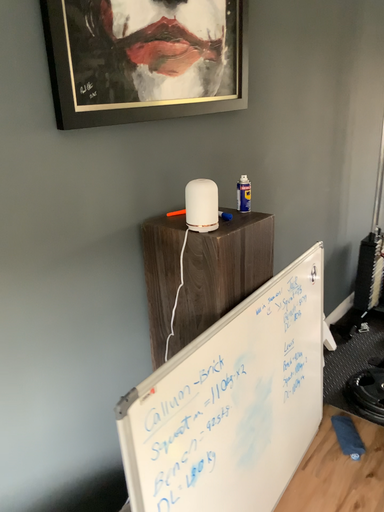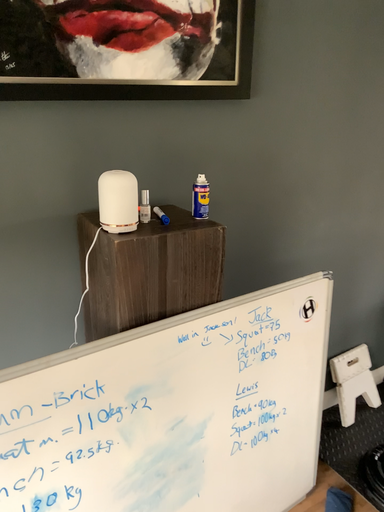
Question: How did the camera likely rotate when shooting the video?

Choices:
 (A) rotated left
 (B) rotated right

Answer: (A)